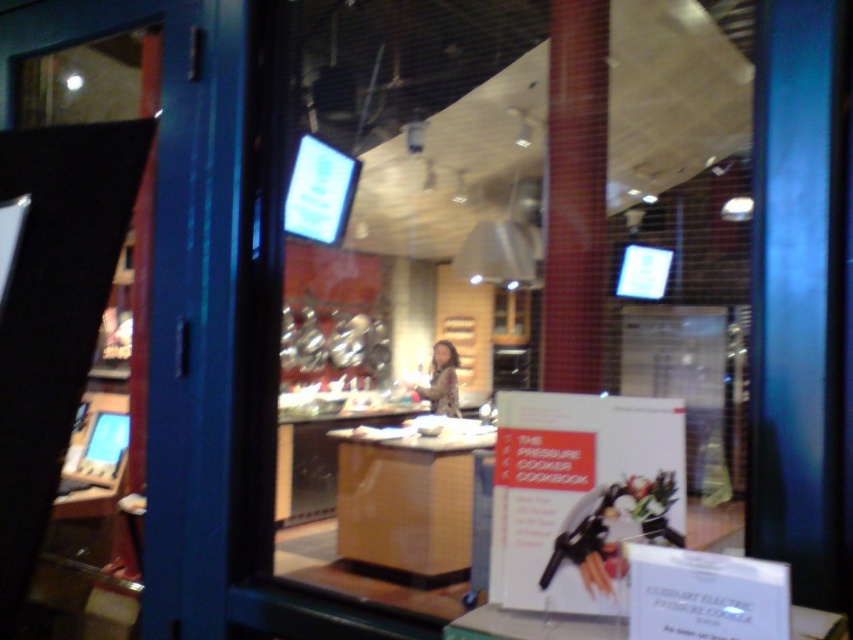
Is white cardboard at center to the right of transparent glass door at left from the viewer's perspective?

Indeed, white cardboard at center is positioned on the right side of transparent glass door at left.

Is white cardboard at center to the left of transparent glass door at left from the viewer's perspective?

Incorrect, white cardboard at center is not on the left side of transparent glass door at left.

Who is more forward, (274, 497) or (68, 22)?

Point (274, 497) is more forward.

You are a GUI agent. You are given a task and a screenshot of the screen. Output one action in this format:
    pyautogui.click(x=<x>, y=<y>)
    Task: Click on the white cardboard at center
    Image resolution: width=853 pixels, height=640 pixels.
    Given the screenshot: What is the action you would take?
    pyautogui.click(x=502, y=272)